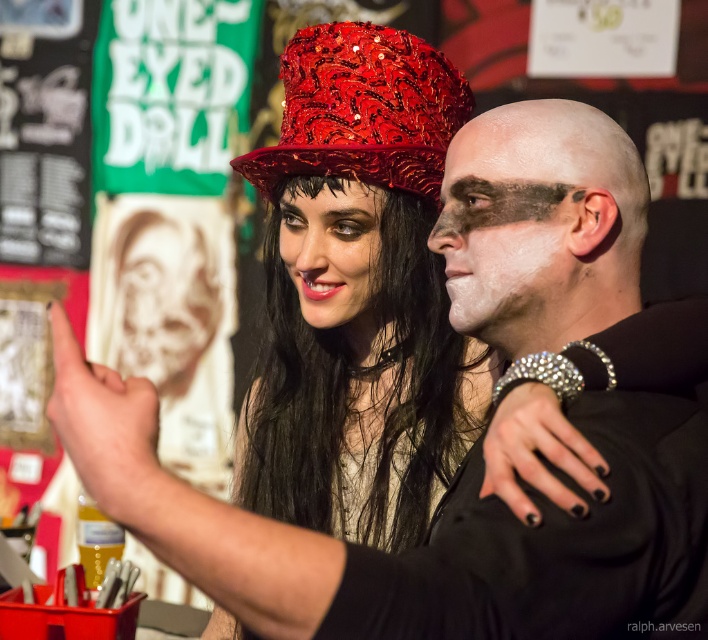
Question: Estimate the real-world distances between objects in this image. Which object is farther from the white matte face at center?

Choices:
 (A) matte black face at center
 (B) shiny sequined hat at upper center

Answer: (A)

Question: Does shiny sequined hat at center lie behind white matte face at center?

Choices:
 (A) no
 (B) yes

Answer: (B)

Question: Which point is farther to the camera?

Choices:
 (A) (406, 93)
 (B) (473, 173)
 (C) (331, 97)
 (D) (309, 301)

Answer: (D)

Question: Observing the image, what is the correct spatial positioning of shiny sequined hat at upper center in reference to matte black face at center?

Choices:
 (A) above
 (B) below

Answer: (A)

Question: Which of the following is the farthest from the observer?

Choices:
 (A) white matte skull at center
 (B) shiny sequined hat at center

Answer: (A)

Question: Can you confirm if shiny sequined hat at upper center is smaller than white matte face at center?

Choices:
 (A) yes
 (B) no

Answer: (B)